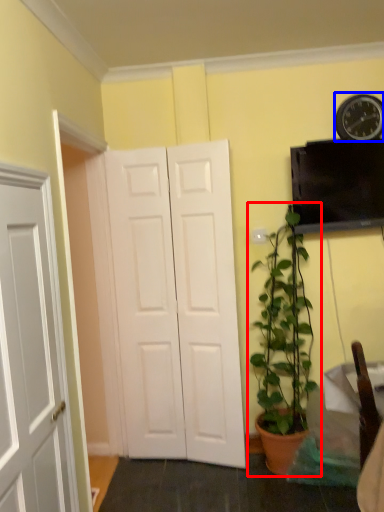
Question: Among these objects, which one is nearest to the camera, houseplant (highlighted by a red box) or clock (highlighted by a blue box)?

Choices:
 (A) houseplant
 (B) clock

Answer: (A)